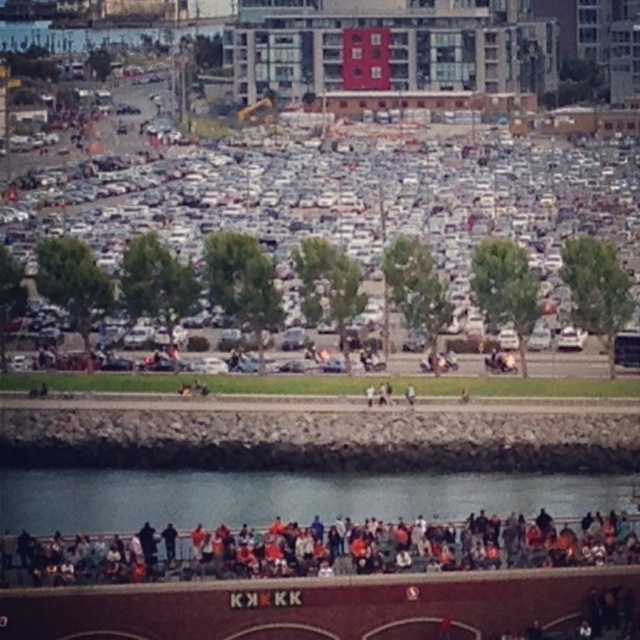
Is the position of clear water at lower center less distant than that of orange fabric crowd at lower center?

No, clear water at lower center is behind orange fabric crowd at lower center.

Is point (96, 497) farther from viewer compared to point (490, 525)?

That is True.

Does point (580, 508) come behind point (104, 540)?

Yes, it is behind point (104, 540).

Where is `clear water at lower center`? clear water at lower center is located at coordinates (285, 497).